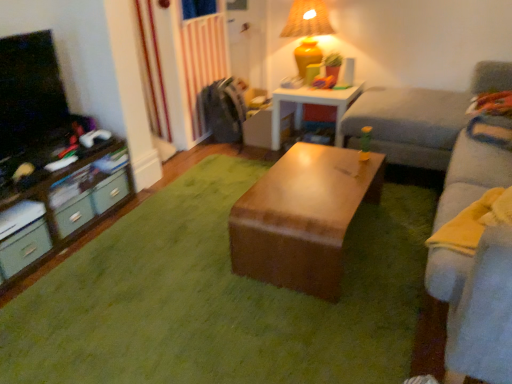
Question: Considering their positions, is wooden table at center, arranged as the second table when viewed from the back, located in front of or behind matte yellow ceramic table lamp at upper right?

Choices:
 (A) behind
 (B) front

Answer: (B)

Question: From a real-world perspective, relative to matte yellow ceramic table lamp at upper right, is wooden table at center, the 2th table when ordered from top to bottom, vertically above or below?

Choices:
 (A) below
 (B) above

Answer: (A)

Question: Based on their relative distances, which object is nearer to the green plastic drawer at left, acting as the 1th drawer starting from the back?

Choices:
 (A) matte yellow ceramic table lamp at upper right
 (B) matte gray drawer at lower left, the third drawer in the back-to-front sequence
 (C) wooden table at center, the second table positioned from the bottom
 (D) wooden table at center, the 2th table when ordered from top to bottom
 (E) matte black desk at left

Answer: (E)

Question: Based on their relative distances, which object is nearer to the green matte drawer at left, positioned as the second drawer in back-to-front order?

Choices:
 (A) matte yellow ceramic table lamp at upper right
 (B) wooden table at center, which ranks as the 1th table in back-to-front order
 (C) matte black desk at left
 (D) light gray fabric couch at right
 (E) matte gray drawer at lower left, placed as the first drawer when sorted from front to back

Answer: (C)